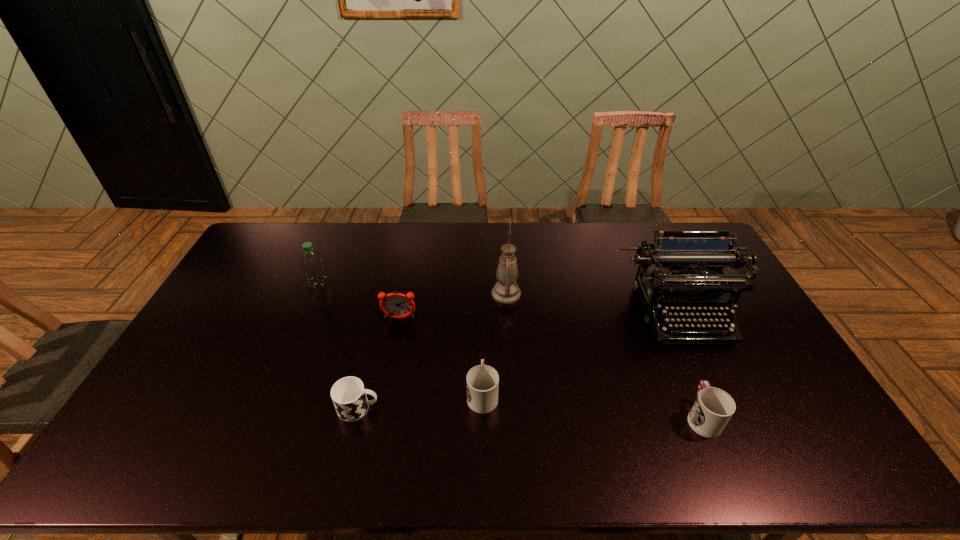
I want to click on object present at the right edge, so (688, 270).

This screenshot has height=540, width=960. I want to click on vacant space at the far edge, so click(x=366, y=231).

In the image, there is a desktop. At what (x,y) coordinates should I click in order to perform the action: click on vacant area at the left edge. Please return your answer as a coordinate pair (x, y). This screenshot has height=540, width=960. Looking at the image, I should click on (234, 329).

This screenshot has width=960, height=540. In order to click on vacant region at the right edge of the desktop in this screenshot , I will do `click(738, 355)`.

Where is `blank space at the far left corner of the desktop`? This screenshot has height=540, width=960. blank space at the far left corner of the desktop is located at coordinates (276, 232).

In order to click on vacant space at the near right corner of the desktop in this screenshot , I will do `click(804, 469)`.

This screenshot has width=960, height=540. In order to click on free point between the rightmost cup and the tallest object in this screenshot , I will do `click(604, 355)`.

Where is `vacant area between the rightmost cup and the leftmost object`? vacant area between the rightmost cup and the leftmost object is located at coordinates (511, 350).

Locate an element on the screen. The height and width of the screenshot is (540, 960). empty space that is in between the second cup from left to right and the oil lamp is located at coordinates (494, 343).

This screenshot has width=960, height=540. I want to click on free space between the second cup from left to right and the oil lamp, so click(494, 343).